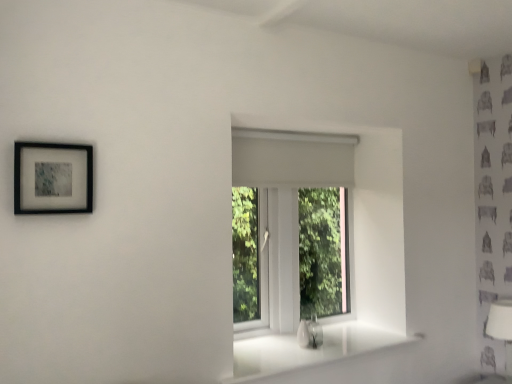
The width and height of the screenshot is (512, 384). What are the coordinates of `blank space situated above white glossy window sill at center (from a real-world perspective)` in the screenshot? It's located at (314, 344).